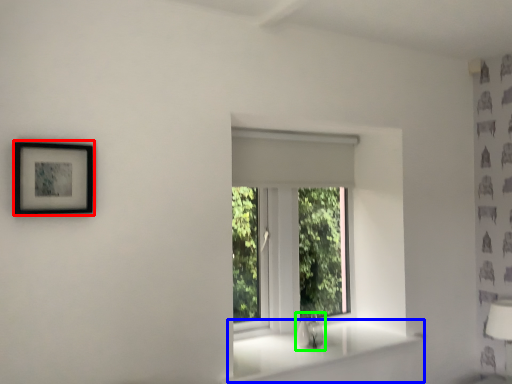
Question: Considering the real-world distances, which object is farthest from picture frame (highlighted by a red box)? window sill (highlighted by a blue box) or sink (highlighted by a green box)?

Choices:
 (A) window sill
 (B) sink

Answer: (B)